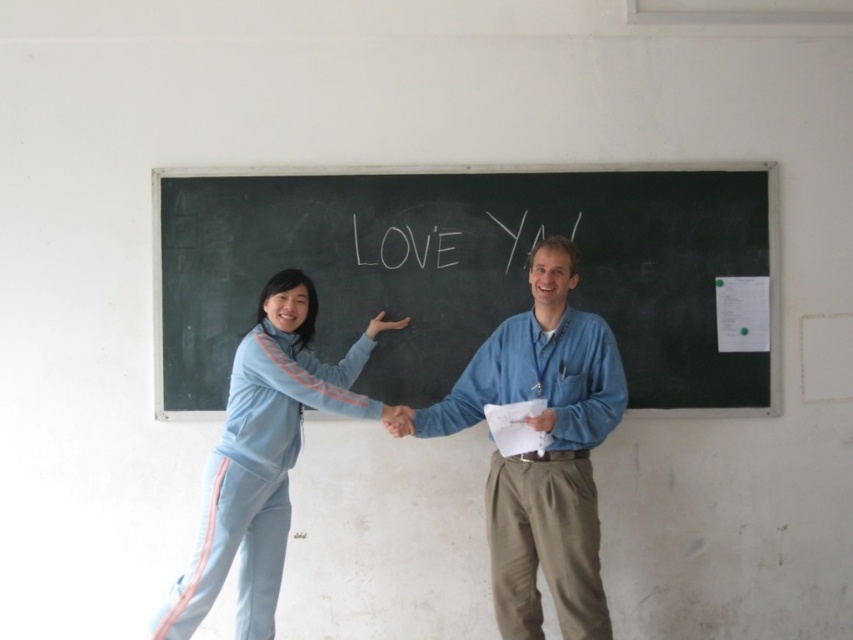
Question: Which point appears farthest from the camera in this image?

Choices:
 (A) (218, 461)
 (B) (613, 200)
 (C) (578, 333)

Answer: (B)

Question: Which object appears farthest from the camera in this image?

Choices:
 (A) blue denim shirt at center
 (B) light blue fabric pants at left

Answer: (B)

Question: Estimate the real-world distances between objects in this image. Which object is farther from the light blue fabric pants at left?

Choices:
 (A) white paper at center
 (B) blue denim shirt at center

Answer: (B)

Question: Is blue denim shirt at center to the left of light blue fabric pants at left from the viewer's perspective?

Choices:
 (A) yes
 (B) no

Answer: (B)

Question: Is blue denim shirt at center bigger than light blue fabric pants at left?

Choices:
 (A) no
 (B) yes

Answer: (A)

Question: Does white paper at center have a smaller size compared to blue denim shirt at center?

Choices:
 (A) yes
 (B) no

Answer: (A)